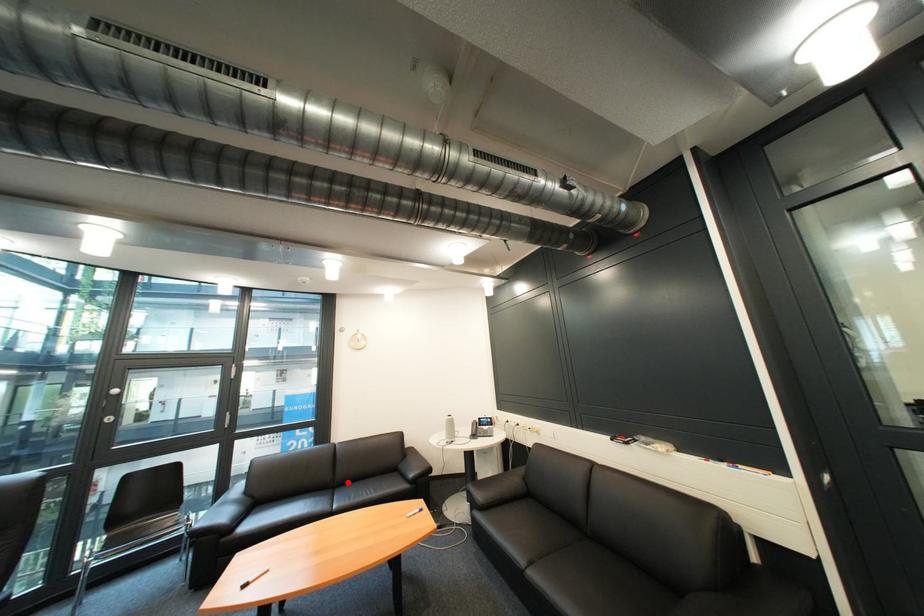
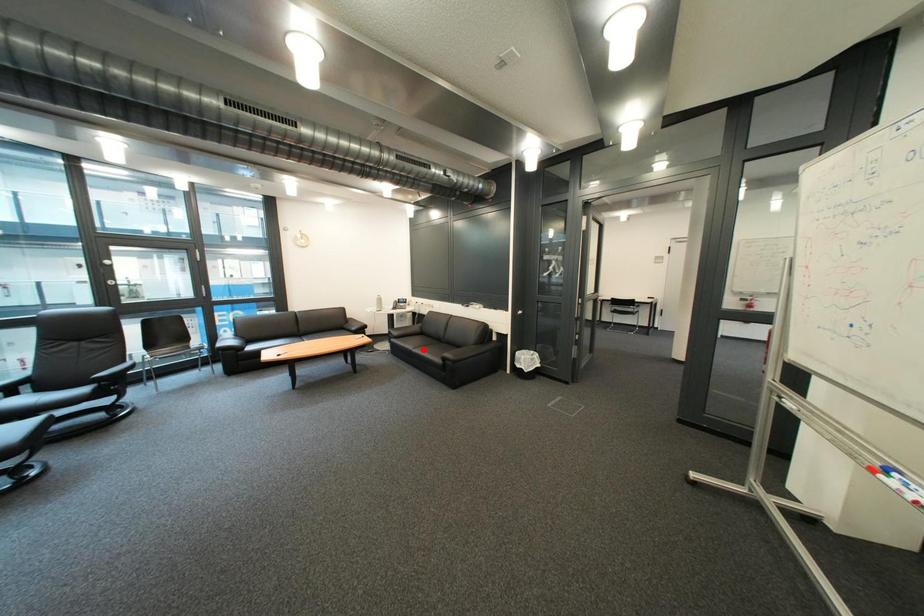
I am providing you with two images of the same scene from different viewpoints. A red point is marked on the first image and another point is marked on the second image. Is the red point in image1 aligned with the point shown in image2?

No